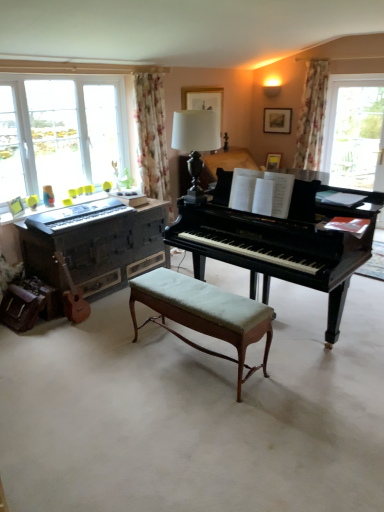
The width and height of the screenshot is (384, 512). Find the location of `vacant region to the left of light green upholstered bench at center`. vacant region to the left of light green upholstered bench at center is located at coordinates (99, 378).